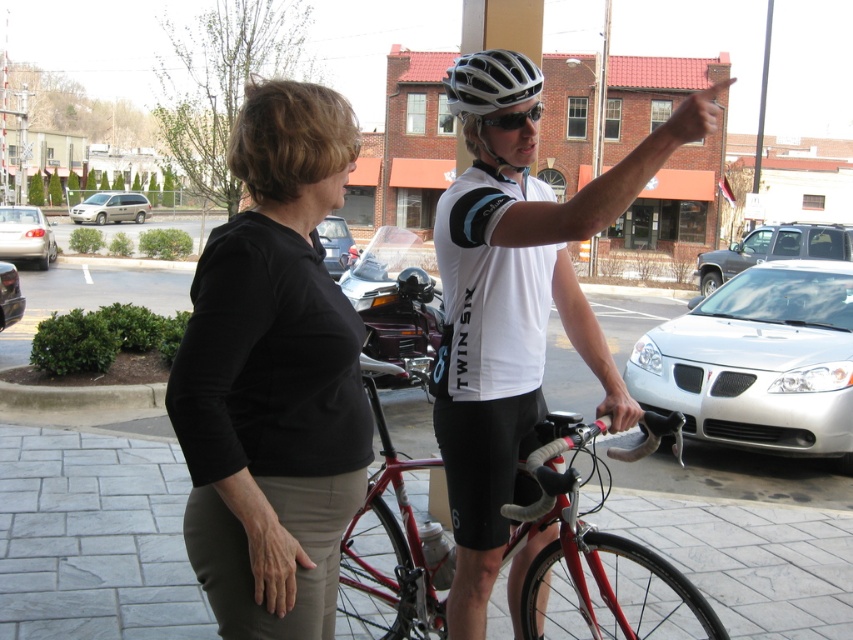
Between silver metallic sedan at lower right and metallic silver sedan at center, which one has less height?

silver metallic sedan at lower right is shorter.

Is silver metallic sedan at lower right wider than metallic silver sedan at center?

No.

Does point (813, 356) come in front of point (326, 244)?

Yes.

I want to click on silver metallic sedan at lower right, so click(758, 362).

Can you confirm if metallic silver motorcycle at center is smaller than black matte sunglasses at upper center?

Incorrect, metallic silver motorcycle at center is not smaller in size than black matte sunglasses at upper center.

Can you confirm if metallic silver motorcycle at center is positioned below black matte sunglasses at upper center?

Incorrect, metallic silver motorcycle at center is not positioned below black matte sunglasses at upper center.

Between point (413, 285) and point (534, 106), which one is positioned behind?

Point (413, 285)

At what (x,y) coordinates should I click in order to perform the action: click on metallic silver motorcycle at center. Please return your answer as a coordinate pair (x, y). Image resolution: width=853 pixels, height=640 pixels. Looking at the image, I should click on (396, 305).

What are the coordinates of `silver metallic sedan at left` in the screenshot? It's located at (25, 236).

Does silver metallic sedan at left have a larger size compared to metallic silver car at lower left?

Indeed, silver metallic sedan at left has a larger size compared to metallic silver car at lower left.

Locate an element on the screen. silver metallic sedan at left is located at coordinates (25, 236).

Locate an element on the screen. The width and height of the screenshot is (853, 640). silver metallic sedan at left is located at coordinates (25, 236).